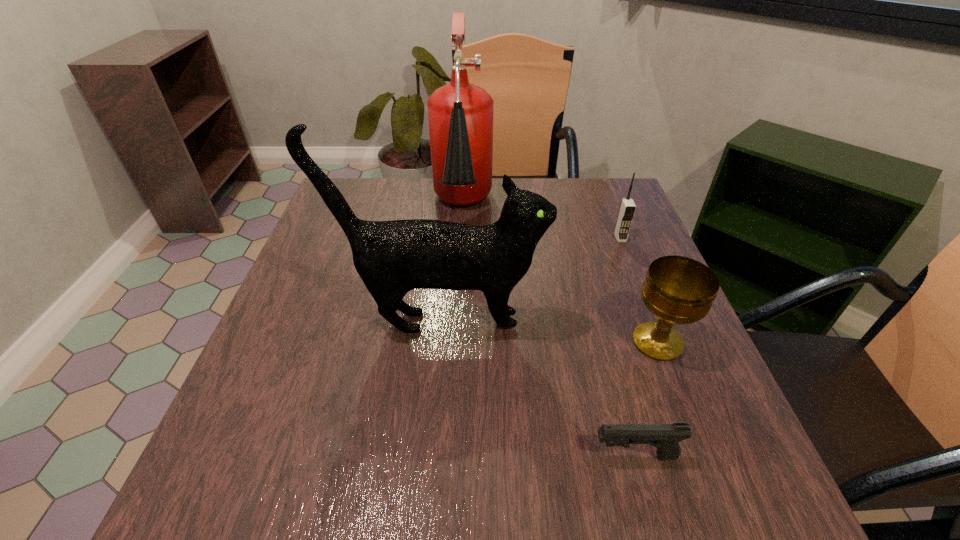
Where is `vacant space located 0.080m at the barrel of the pistol`? Image resolution: width=960 pixels, height=540 pixels. vacant space located 0.080m at the barrel of the pistol is located at coordinates (540, 456).

This screenshot has width=960, height=540. Identify the location of free space located at the barrel of the pistol. (533, 456).

I want to click on vacant region located 0.140m at the barrel of the pistol, so click(x=500, y=456).

Identify the location of object located at the far edge. This screenshot has width=960, height=540. (460, 115).

Locate an element on the screen. The height and width of the screenshot is (540, 960). object that is at the near edge is located at coordinates (665, 437).

I want to click on object at the left edge, so click(x=392, y=258).

The height and width of the screenshot is (540, 960). What are the coordinates of `cellular telephone that is at the right edge` in the screenshot? It's located at (627, 208).

At what (x,y) coordinates should I click in order to perform the action: click on chalice situated at the right edge. Please return your answer as a coordinate pair (x, y). Looking at the image, I should click on (678, 290).

This screenshot has width=960, height=540. What are the coordinates of `pistol situated at the right edge` in the screenshot? It's located at (665, 437).

Locate an element on the screen. Image resolution: width=960 pixels, height=540 pixels. object that is at the near right corner is located at coordinates (665, 437).